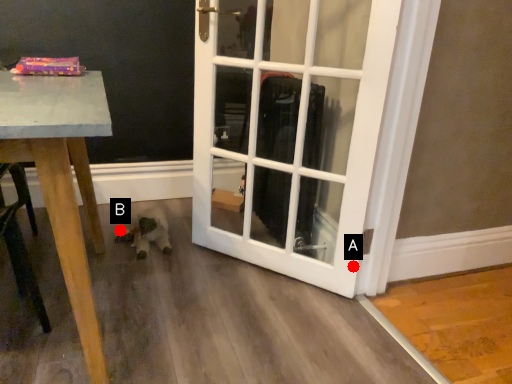
Question: Two points are circled on the image, labeled by A and B beside each circle. Which of the following is the farthest from the observer?

Choices:
 (A) A is further
 (B) B is further

Answer: (B)